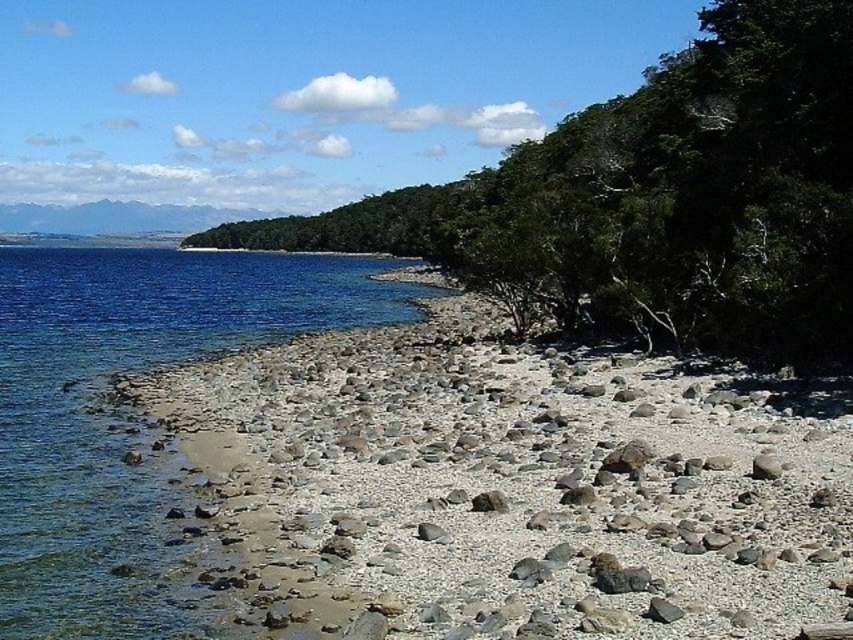
Does white gravel at lower left have a lesser height compared to gray smooth rock at center?

Incorrect, white gravel at lower left's height does not fall short of gray smooth rock at center's.

Who is positioned more to the left, white gravel at lower left or gray smooth rock at center?

From the viewer's perspective, gray smooth rock at center appears more on the left side.

Which is in front, point (311, 364) or point (439, 540)?

Point (439, 540) is more forward.

Image resolution: width=853 pixels, height=640 pixels. I want to click on white gravel at lower left, so click(509, 486).

Does green leafy tree at upper center have a lesser height compared to gray rock at lower center?

Incorrect, green leafy tree at upper center's height does not fall short of gray rock at lower center's.

Is green leafy tree at upper center smaller than gray rock at lower center?

No, green leafy tree at upper center is not smaller than gray rock at lower center.

Does point (280, 246) come farther from viewer compared to point (613, 573)?

Yes, point (280, 246) is farther from viewer.

The image size is (853, 640). Find the location of `green leafy tree at upper center`. green leafy tree at upper center is located at coordinates (656, 200).

Which is more to the left, blue water at lower left or gray smooth rock at center?

Positioned to the left is blue water at lower left.

You are a GUI agent. You are given a task and a screenshot of the screen. Output one action in this format:
    pyautogui.click(x=<x>, y=<y>)
    Task: Click on the blue water at lower left
    This screenshot has height=640, width=853.
    Given the screenshot: What is the action you would take?
    pyautogui.click(x=129, y=417)

Image resolution: width=853 pixels, height=640 pixels. Identify the location of blue water at lower left. (129, 417).